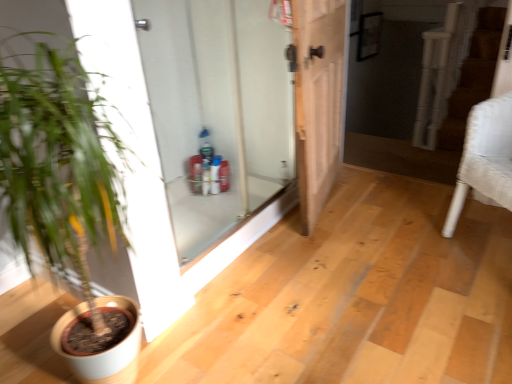
This screenshot has width=512, height=384. I want to click on empty space that is to the right of light brown wooden door at center, arranged as the 2th door when viewed from the left, so click(x=383, y=206).